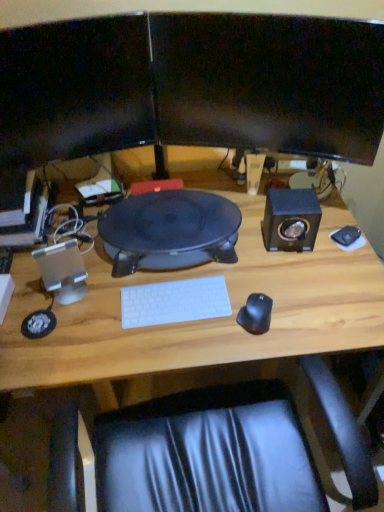
At what (x,y) coordinates should I click in order to perform the action: click on free area behind white plastic keyboard at center. Please return your answer as a coordinate pair (x, y). Looking at the image, I should click on (178, 270).